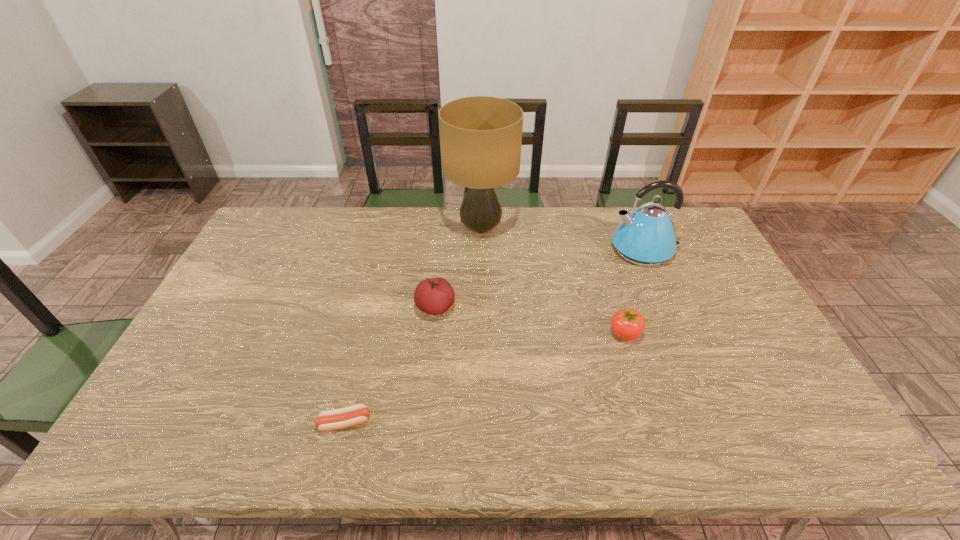
Identify the location of blank area at the far edge. This screenshot has height=540, width=960. (445, 213).

Locate an element on the screen. The width and height of the screenshot is (960, 540). free space at the near edge is located at coordinates (476, 422).

I want to click on vacant region at the left edge of the desktop, so click(226, 289).

Locate an element on the screen. free location at the right edge of the desktop is located at coordinates pos(724,367).

Image resolution: width=960 pixels, height=540 pixels. What are the coordinates of `free spot at the far left corner of the desktop` in the screenshot? It's located at (262, 234).

This screenshot has height=540, width=960. In the image, there is a desktop. Find the location of `vacant space at the near right corner`. vacant space at the near right corner is located at coordinates (768, 420).

You are a GUI agent. You are given a task and a screenshot of the screen. Output one action in this format:
    pyautogui.click(x=<x>, y=<y>)
    Task: Click on the free space between the kettle and the fourth tallest object
    The image size is (960, 540).
    Given the screenshot: What is the action you would take?
    pyautogui.click(x=635, y=292)

Image resolution: width=960 pixels, height=540 pixels. What are the coordinates of `free space between the tallest object and the third shortest object` in the screenshot? It's located at (458, 267).

Where is `free spot between the shorter tomato and the fourth shortest object`? Image resolution: width=960 pixels, height=540 pixels. free spot between the shorter tomato and the fourth shortest object is located at coordinates (635, 292).

Where is `vacant area that lies between the right tomato and the leftmost object`? The height and width of the screenshot is (540, 960). vacant area that lies between the right tomato and the leftmost object is located at coordinates (485, 378).